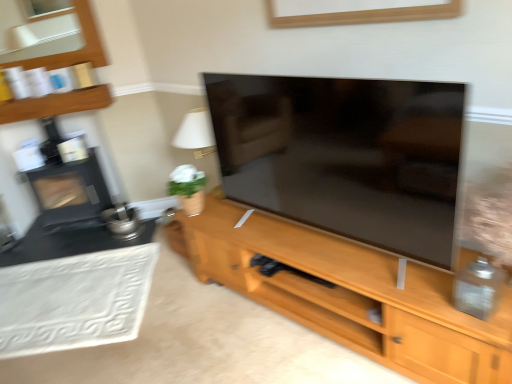
Question: Is black matte fireplace at left in front of wooden shelf at upper left?

Choices:
 (A) yes
 (B) no

Answer: (B)

Question: Is black matte fireplace at left thinner than wooden shelf at upper left?

Choices:
 (A) yes
 (B) no

Answer: (B)

Question: Does black matte fireplace at left have a smaller size compared to wooden shelf at upper left?

Choices:
 (A) no
 (B) yes

Answer: (A)

Question: From the image's perspective, is black matte fireplace at left above wooden shelf at upper left?

Choices:
 (A) yes
 (B) no

Answer: (B)

Question: Can you confirm if black matte fireplace at left is positioned to the left of wooden shelf at upper left?

Choices:
 (A) no
 (B) yes

Answer: (B)

Question: Can we say black matte fireplace at left lies outside wooden shelf at upper left?

Choices:
 (A) yes
 (B) no

Answer: (A)

Question: Considering the relative sizes of wooden cabinet at center and white textured rug at lower left in the image provided, is wooden cabinet at center bigger than white textured rug at lower left?

Choices:
 (A) yes
 (B) no

Answer: (A)

Question: Does wooden cabinet at center have a smaller size compared to white textured rug at lower left?

Choices:
 (A) no
 (B) yes

Answer: (A)

Question: Is wooden cabinet at center not inside white textured rug at lower left?

Choices:
 (A) no
 (B) yes

Answer: (B)

Question: Is wooden cabinet at center at the left side of white textured rug at lower left?

Choices:
 (A) yes
 (B) no

Answer: (B)

Question: Is wooden cabinet at center placed right next to white textured rug at lower left?

Choices:
 (A) yes
 (B) no

Answer: (B)

Question: Is wooden cabinet at center positioned behind white textured rug at lower left?

Choices:
 (A) no
 (B) yes

Answer: (A)

Question: From a real-world perspective, is black matte fireplace at left positioned under wooden cabinet at center based on gravity?

Choices:
 (A) no
 (B) yes

Answer: (A)